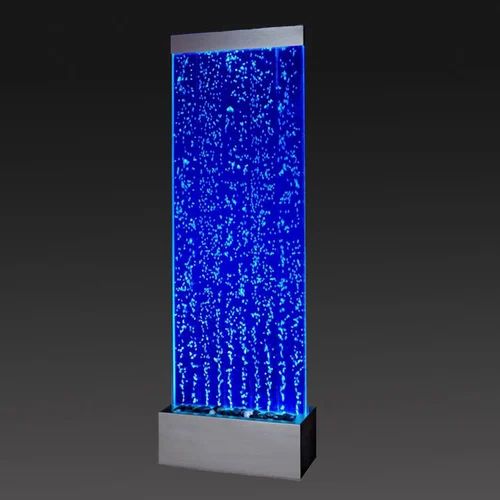
The width and height of the screenshot is (500, 500). In order to click on lights in this screenshot , I will do `click(245, 412)`, `click(210, 414)`.